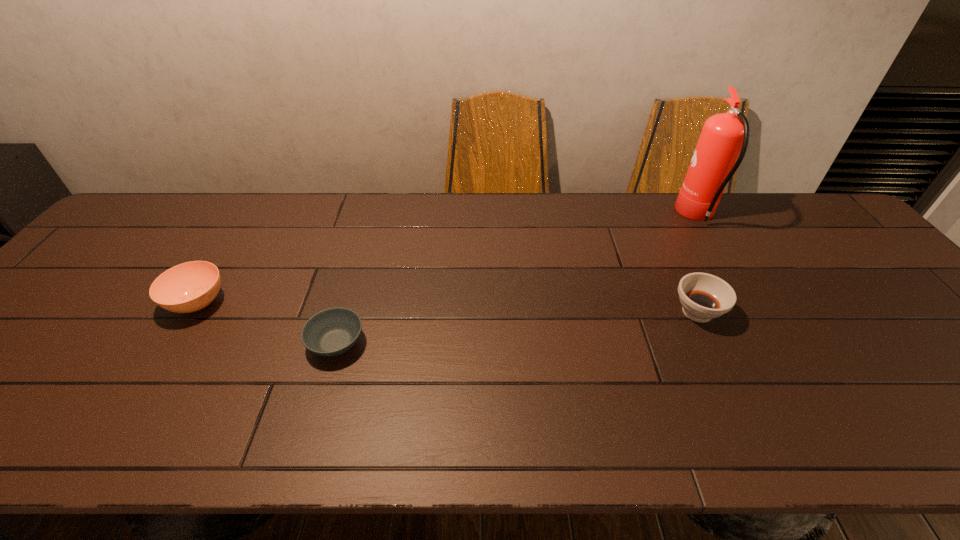
This screenshot has width=960, height=540. Identify the location of soup bowl that can be found as the second closest to the third object from right to left. (703, 296).

Where is `vacant space that satisfies the following two spatial constraints: 1. on the front side of the leftmost soup bowl; 2. on the left side of the shortest soup bowl`? Image resolution: width=960 pixels, height=540 pixels. vacant space that satisfies the following two spatial constraints: 1. on the front side of the leftmost soup bowl; 2. on the left side of the shortest soup bowl is located at coordinates (173, 343).

Where is `free space that satisfies the following two spatial constraints: 1. towards the nozzle of the rightmost object; 2. on the front side of the leftmost soup bowl`? This screenshot has width=960, height=540. free space that satisfies the following two spatial constraints: 1. towards the nozzle of the rightmost object; 2. on the front side of the leftmost soup bowl is located at coordinates (749, 302).